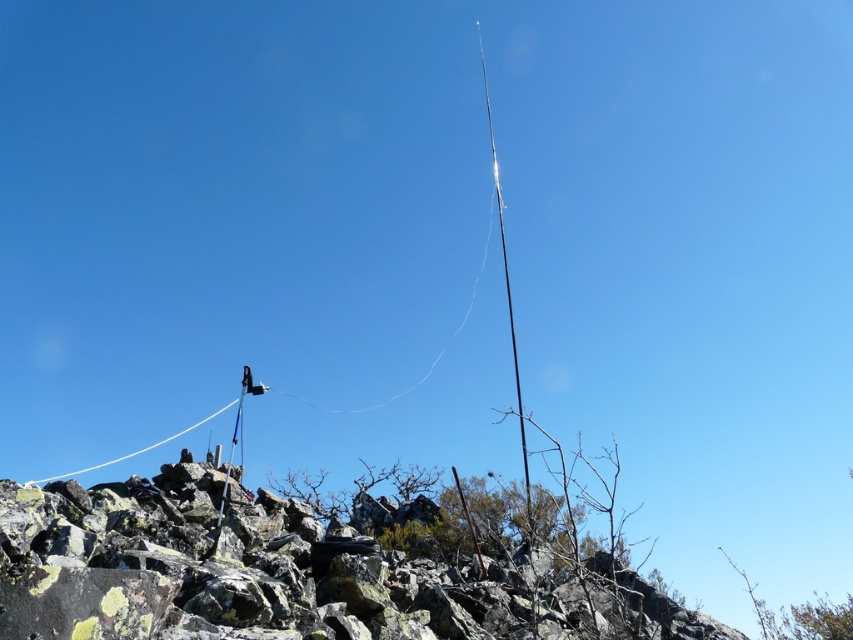
You are standing at the base of the antenna in the middle ground of the rocky terrain. You notice two points marked on the ground ahead of you. The first point is at coordinates point (527,554) and the second is at point (126,458). Which point is closer to your current position?

Point (527,554) is closer to the viewer than point (126,458), so the first point is closer to your current position.

You are a hiker trying to navigate through the rocky terrain. You notice a rough stone hill at center and a white string at upper left. Which object is nearer to you as you stand on the path?

The rough stone hill at center is closer to the viewer than the white string at upper left, so the rough stone hill at center is nearer to you.